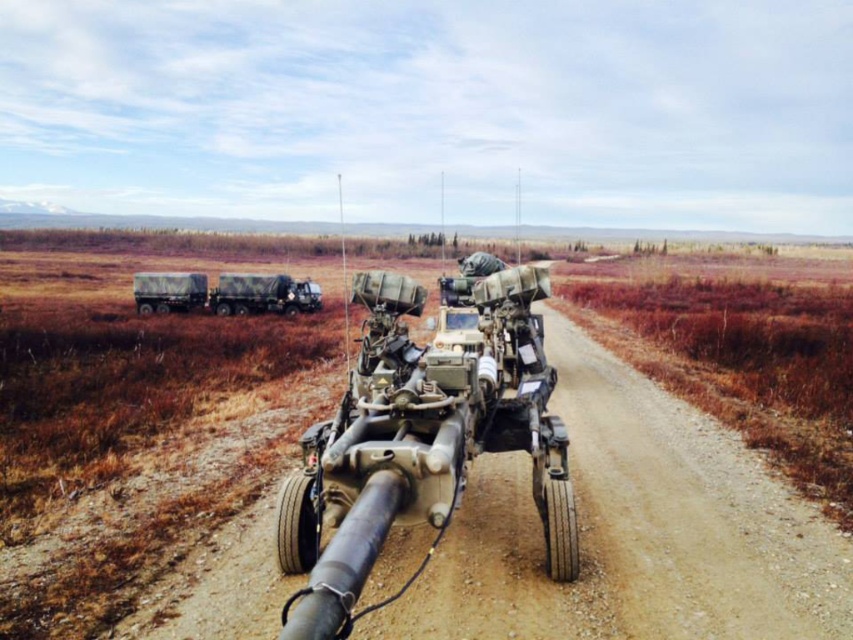
Does camouflage fabric tank at center have a greater height compared to camouflage fabric truck at left?

Correct, camouflage fabric tank at center is much taller as camouflage fabric truck at left.

This screenshot has height=640, width=853. Identify the location of camouflage fabric tank at center. (422, 436).

Identify the location of camouflage fabric tank at center. This screenshot has height=640, width=853. (422, 436).

Which is behind, point (299, 289) or point (140, 298)?

The point (299, 289) is behind.

Is muddy camouflage truck at left closer to camera compared to camouflage fabric truck at left?

No, it is not.

Looking at this image, who is more distant from viewer, (283, 276) or (157, 282)?

Point (283, 276)

Locate an element on the screen. The width and height of the screenshot is (853, 640). muddy camouflage truck at left is located at coordinates (263, 294).

Where is `camouflage fabric tank at center`? camouflage fabric tank at center is located at coordinates (422, 436).

Can you confirm if camouflage fabric tank at center is smaller than muddy camouflage truck at left?

No, camouflage fabric tank at center is not smaller than muddy camouflage truck at left.

At what (x,y) coordinates should I click in order to perform the action: click on camouflage fabric tank at center. Please return your answer as a coordinate pair (x, y). Looking at the image, I should click on (422, 436).